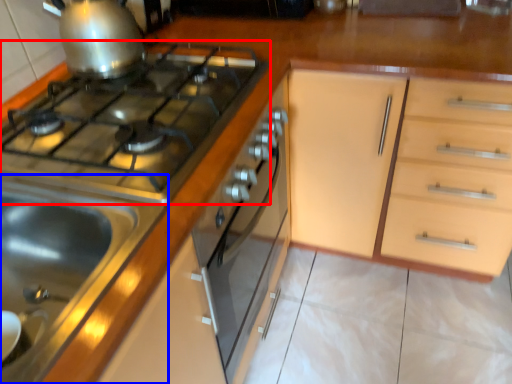
Question: Which object appears farthest to the camera in this image, gas stove (highlighted by a red box) or sink (highlighted by a blue box)?

Choices:
 (A) gas stove
 (B) sink

Answer: (A)